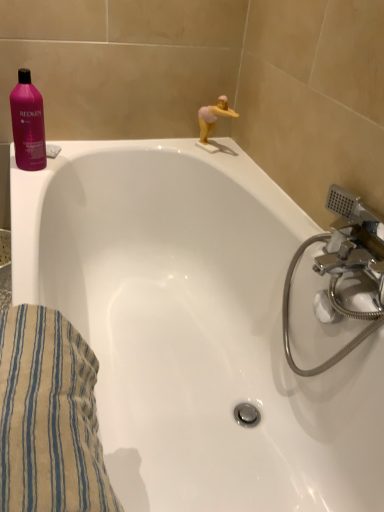
Question: Could you tell me if white glossy bathtub at upper left is facing pink glossy shampoo at upper left?

Choices:
 (A) yes
 (B) no

Answer: (B)

Question: Can you confirm if white glossy bathtub at upper left is taller than pink glossy shampoo at upper left?

Choices:
 (A) yes
 (B) no

Answer: (A)

Question: Is pink glossy shampoo at upper left inside white glossy bathtub at upper left?

Choices:
 (A) yes
 (B) no

Answer: (B)

Question: From the image's perspective, would you say white glossy bathtub at upper left is positioned over pink glossy shampoo at upper left?

Choices:
 (A) no
 (B) yes

Answer: (A)

Question: Is the position of white glossy bathtub at upper left more distant than that of pink glossy shampoo at upper left?

Choices:
 (A) no
 (B) yes

Answer: (A)

Question: Considering the positions of point (311, 227) and point (203, 119), is point (311, 227) closer or farther from the camera than point (203, 119)?

Choices:
 (A) closer
 (B) farther

Answer: (A)

Question: Is white glossy bathtub at upper left taller or shorter than pink rubber duck at upper right?

Choices:
 (A) tall
 (B) short

Answer: (A)

Question: Which is correct: white glossy bathtub at upper left is inside pink rubber duck at upper right, or outside of it?

Choices:
 (A) outside
 (B) inside

Answer: (A)

Question: Considering their positions, is white glossy bathtub at upper left located in front of or behind pink rubber duck at upper right?

Choices:
 (A) behind
 (B) front

Answer: (B)

Question: From a real-world perspective, relative to pink glossy shampoo at upper left, is pink rubber duck at upper right vertically above or below?

Choices:
 (A) above
 (B) below

Answer: (B)

Question: In the image, is pink rubber duck at upper right positioned in front of or behind pink glossy shampoo at upper left?

Choices:
 (A) behind
 (B) front

Answer: (A)

Question: Is pink rubber duck at upper right to the left or to the right of pink glossy shampoo at upper left in the image?

Choices:
 (A) right
 (B) left

Answer: (A)

Question: In terms of size, does pink rubber duck at upper right appear bigger or smaller than pink glossy shampoo at upper left?

Choices:
 (A) small
 (B) big

Answer: (A)

Question: Looking at their shapes, would you say beige striped towel at lower left is wider or thinner than pink rubber duck at upper right?

Choices:
 (A) wide
 (B) thin

Answer: (A)

Question: Choose the correct answer: Is beige striped towel at lower left inside pink rubber duck at upper right or outside it?

Choices:
 (A) outside
 (B) inside

Answer: (A)